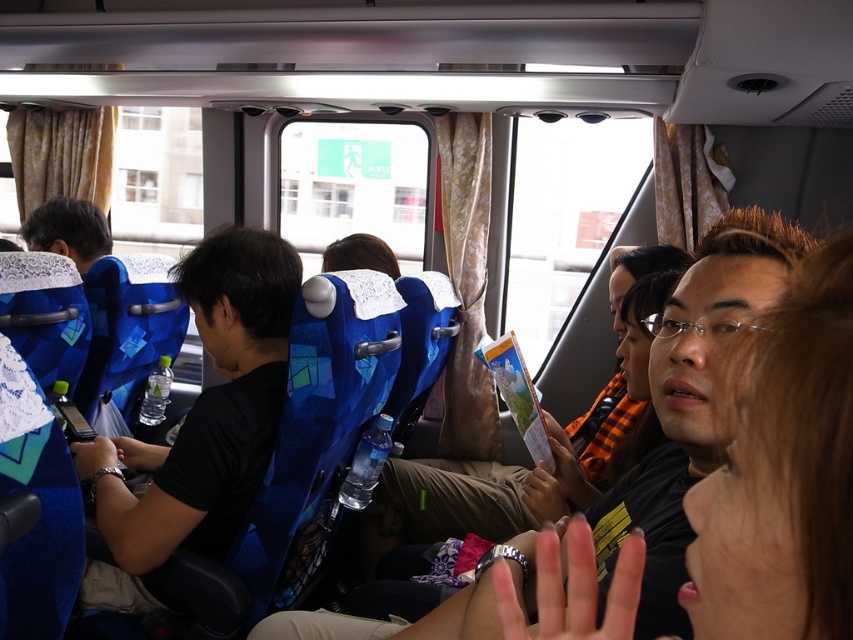
Can you confirm if black matte shirt at center is shorter than matte black hair at left?

No, black matte shirt at center is not shorter than matte black hair at left.

Based on the photo, can you confirm if black matte shirt at center is positioned above matte black hair at left?

No.

Measure the distance between point (120, 563) and camera.

The distance of point (120, 563) from camera is 1.45 meters.

Locate an element on the screen. black matte shirt at center is located at coordinates (200, 422).